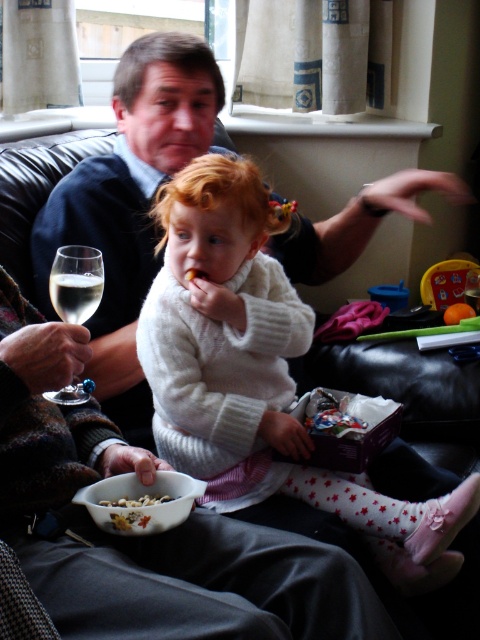
Does point (166, 328) lie in front of point (121, 499)?

No, (166, 328) is further to viewer.

Is white knitted sweater at center above crumbly brown cereal at lower left?

Yes, white knitted sweater at center is above crumbly brown cereal at lower left.

What do you see at coordinates (257, 371) in the screenshot? I see `white knitted sweater at center` at bounding box center [257, 371].

Find the location of a particular element. The image size is (480, 640). white knitted sweater at center is located at coordinates (257, 371).

Identify the location of clear glass wine glass at left. (75, 282).

Between clear glass wine glass at left and crumbly brown cereal at lower left, which one is positioned lower?

Positioned lower is crumbly brown cereal at lower left.

Image resolution: width=480 pixels, height=640 pixels. Identify the location of clear glass wine glass at left. (75, 282).

Is smooth white bowl at lower left taller than clear glass wine at upper left?

No.

Does smooth white bowl at lower left lie in front of clear glass wine at upper left?

Yes, it is in front of clear glass wine at upper left.

Who is more forward, (184, 508) or (74, 298)?

Point (184, 508) is more forward.

The image size is (480, 640). Find the location of `smooth white bowl at lower left`. smooth white bowl at lower left is located at coordinates (143, 513).